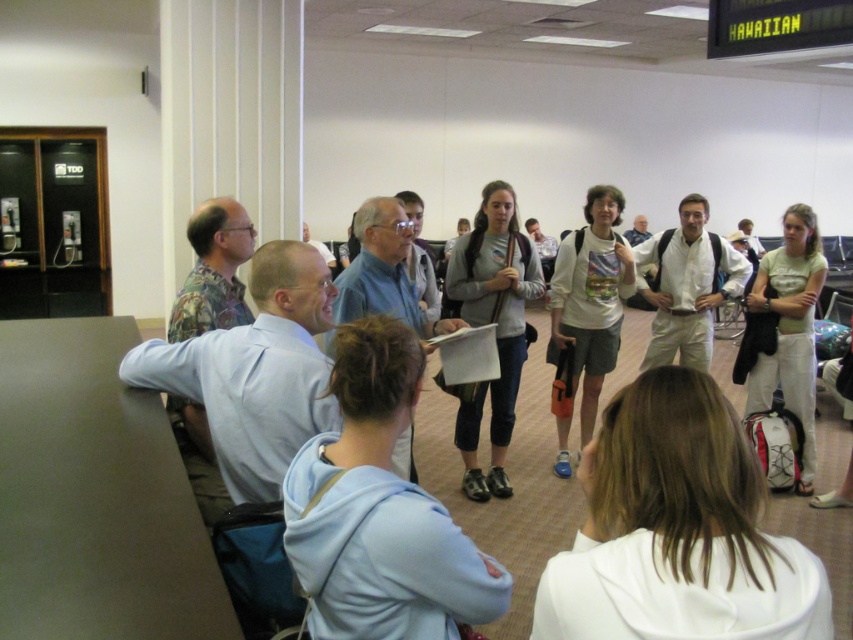
You are a traveler looking for your luggage at the airport. You see a white cotton hoodie at center and a gray cotton hoodie at center. Which hoodie is closer to the floor?

The white cotton hoodie at center is located below gray cotton hoodie at center, so the white cotton hoodie at center is closer to the floor.